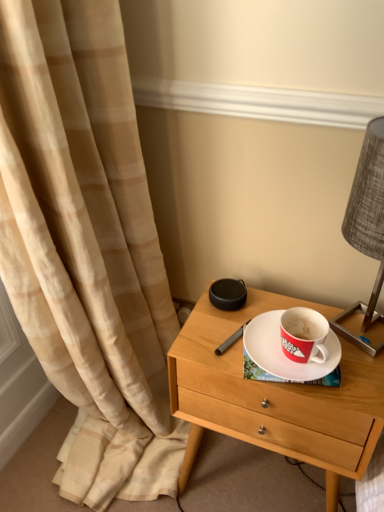
Image resolution: width=384 pixels, height=512 pixels. I want to click on free location to the right of white matte saucer at center, so click(x=362, y=346).